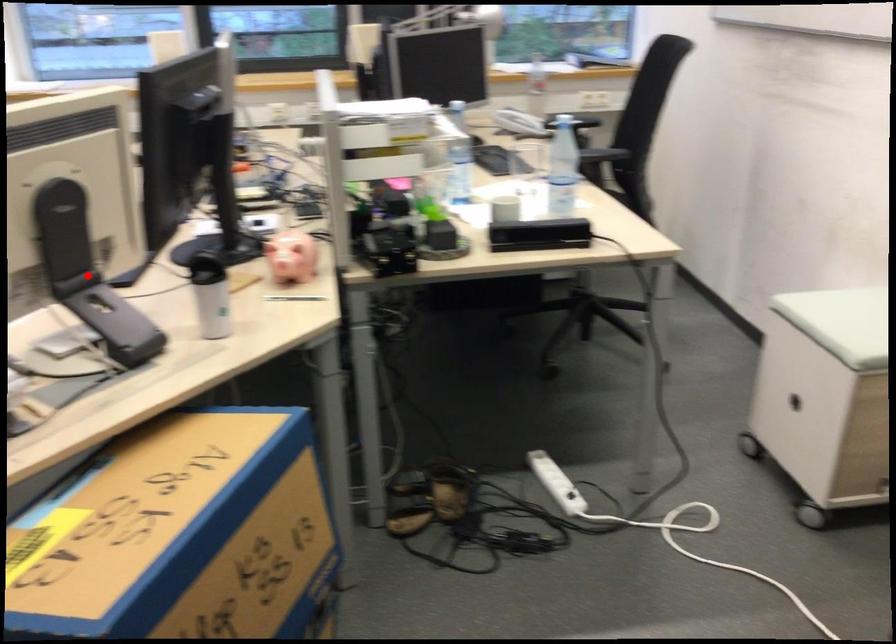
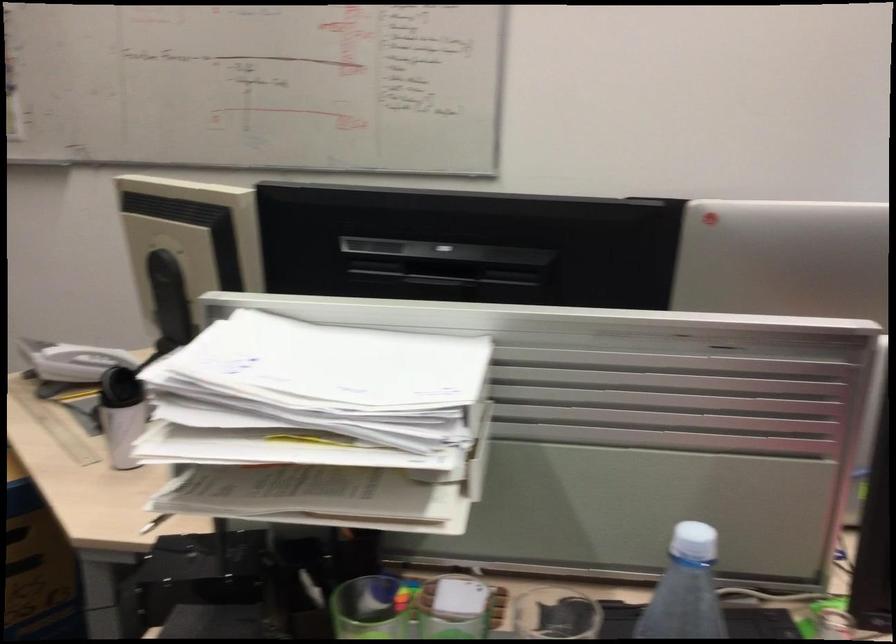
Question: I am providing you with two images of the same scene from different viewpoints. A red point is marked on the first image. At the location where the point appears in image 1, is it still visible in image 2?

Choices:
 (A) Yes
 (B) No

Answer: (B)